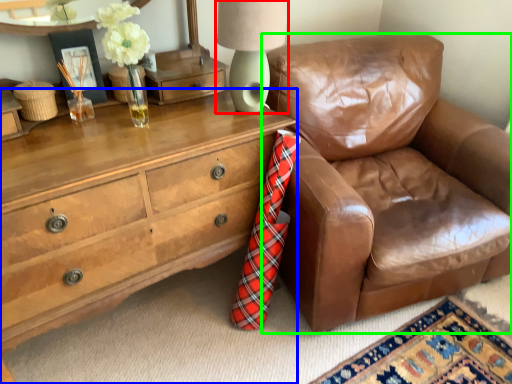
Question: Based on their relative distances, which object is farther from table lamp (highlighted by a red box)? Choose from chest of drawers (highlighted by a blue box) and chair (highlighted by a green box).

Choices:
 (A) chest of drawers
 (B) chair

Answer: (B)